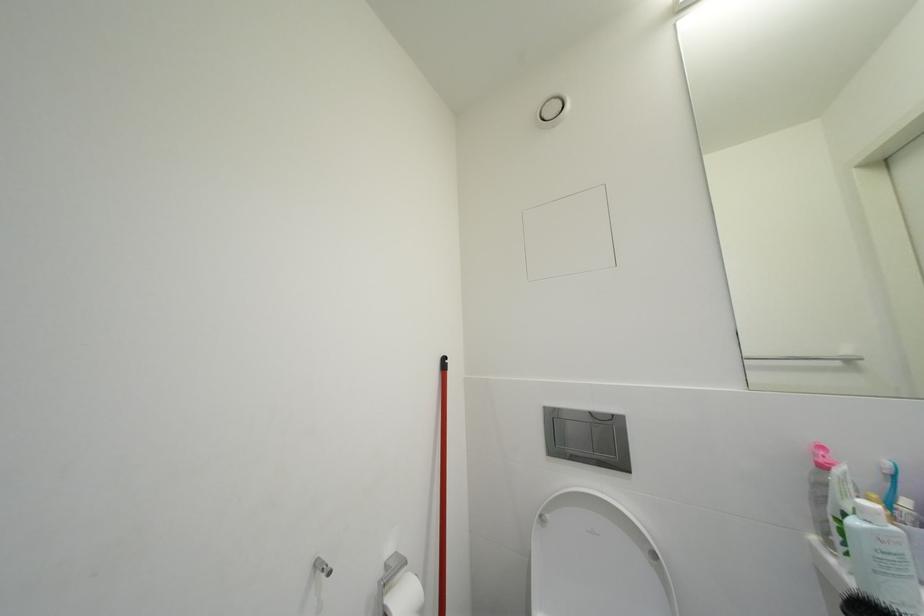
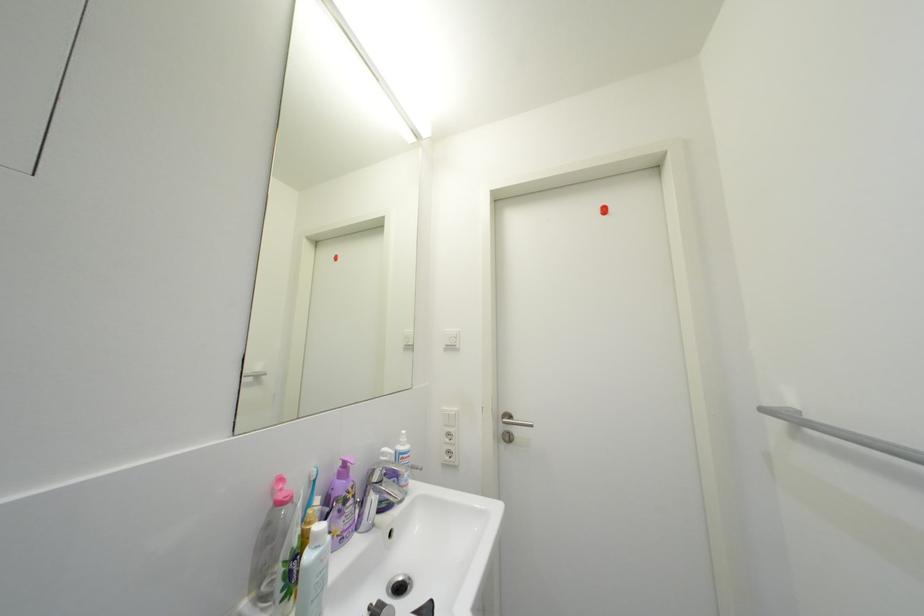
Question: How did the camera likely rotate?

Choices:
 (A) Left
 (B) Right
 (C) Up
 (D) Down

Answer: (B)